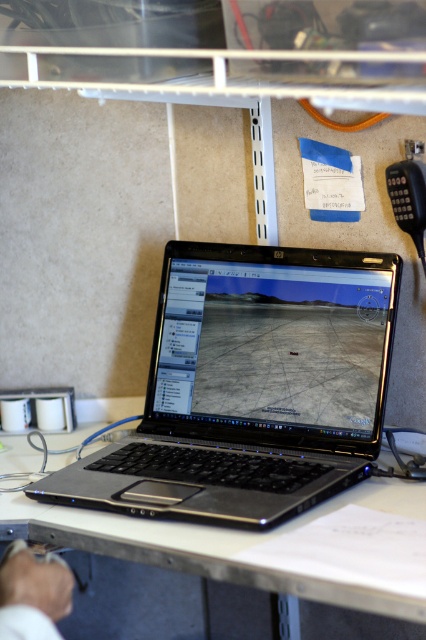
Is white plastic table at center below white fabric hand at lower left?

No.

Is white plastic table at center to the left of white fabric hand at lower left from the viewer's perspective?

Incorrect, white plastic table at center is not on the left side of white fabric hand at lower left.

What do you see at coordinates (219, 545) in the screenshot? This screenshot has height=640, width=426. I see `white plastic table at center` at bounding box center [219, 545].

Identify the location of white plastic table at center. The image size is (426, 640). (219, 545).

Is point (353, 460) farther from camera compared to point (69, 592)?

Yes.

At what (x,y) coordinates should I click in order to perform the action: click on satin black laptop at center. Please return your answer as a coordinate pair (x, y). Looking at the image, I should click on (250, 387).

Does satin black laptop at center appear under white plastic table at center?

Incorrect, satin black laptop at center is not positioned below white plastic table at center.

What do you see at coordinates (250, 387) in the screenshot?
I see `satin black laptop at center` at bounding box center [250, 387].

Between point (242, 493) and point (149, 547), which one is positioned in front?

Point (149, 547)

The width and height of the screenshot is (426, 640). What are the coordinates of `satin black laptop at center` in the screenshot? It's located at (250, 387).